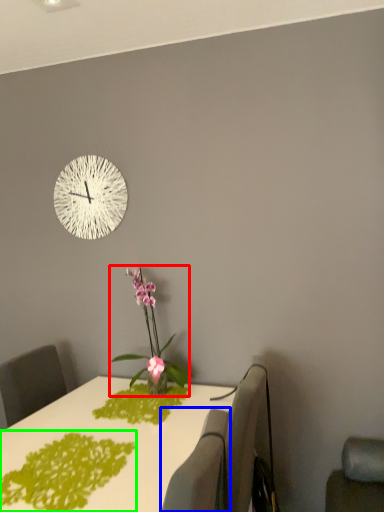
Question: Estimate the real-world distances between objects in this image. Which object is farther from houseplant (highlighted by a red box), swivel chair (highlighted by a blue box) or design (highlighted by a green box)?

Choices:
 (A) swivel chair
 (B) design

Answer: (A)